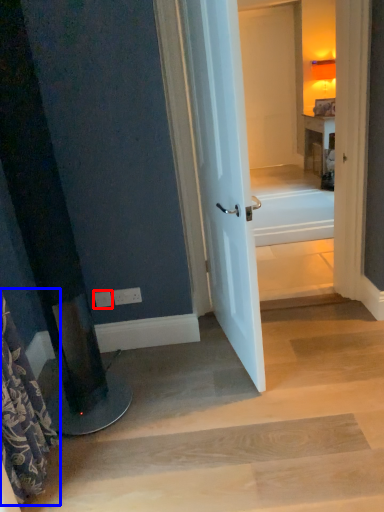
Question: Which point is further to the camera, electric outlet (highlighted by a red box) or shower curtain (highlighted by a blue box)?

Choices:
 (A) electric outlet
 (B) shower curtain

Answer: (A)